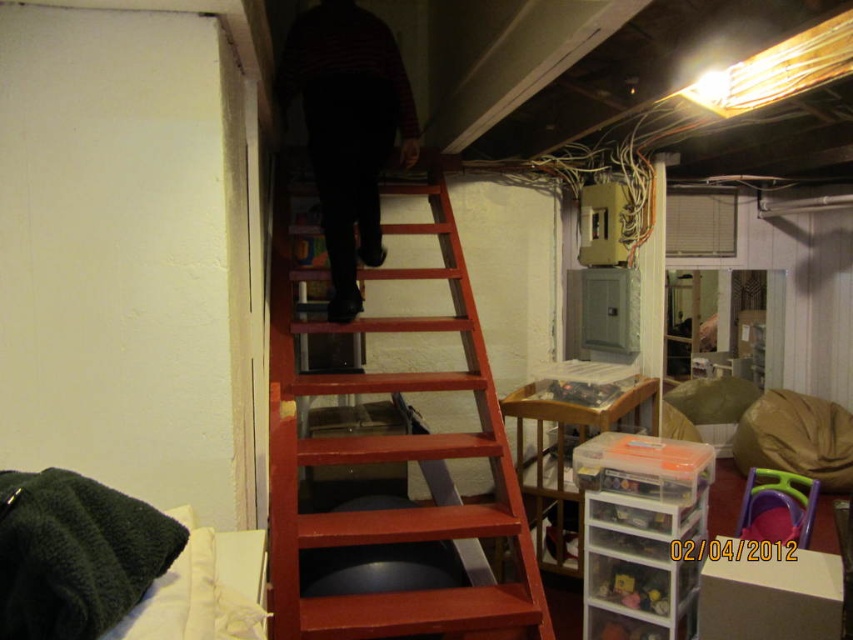
Question: Does wooden ladder at center appear on the left side of striped sweater at upper center?

Choices:
 (A) yes
 (B) no

Answer: (B)

Question: Which point is closer to the camera taking this photo?

Choices:
 (A) (277, 321)
 (B) (379, 132)

Answer: (A)

Question: Can you confirm if wooden ladder at center is thinner than striped sweater at upper center?

Choices:
 (A) yes
 (B) no

Answer: (B)

Question: Which of the following is the closest to the observer?

Choices:
 (A) (335, 308)
 (B) (364, 515)

Answer: (B)

Question: Is wooden ladder at center smaller than striped sweater at upper center?

Choices:
 (A) yes
 (B) no

Answer: (B)

Question: Among these objects, which one is farthest from the camera?

Choices:
 (A) striped sweater at upper center
 (B) wooden ladder at center

Answer: (A)